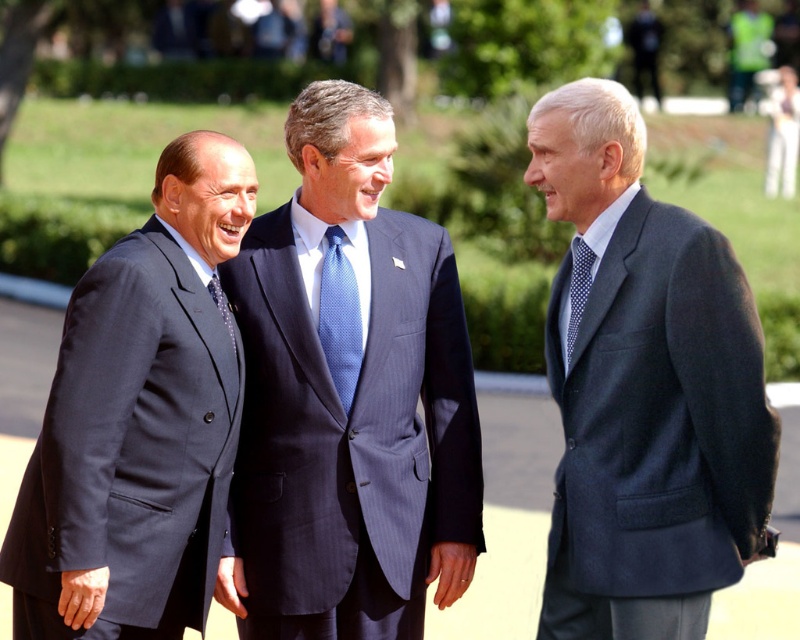
Question: Can you confirm if blue pinstripe suit at center is positioned above matte black tie at center?

Choices:
 (A) yes
 (B) no

Answer: (B)

Question: Estimate the real-world distances between objects in this image. Which object is farther from the blue pinstripe suit at center?

Choices:
 (A) blue dotted tie at center
 (B) dark blue suit at left
 (C) polka dot silk tie at center
 (D) dark gray wool suit at right

Answer: (C)

Question: Which object is the closest to the dark blue suit at left?

Choices:
 (A) matte black tie at center
 (B) blue dotted tie at center
 (C) dark gray wool suit at right

Answer: (A)

Question: Which of the following is the closest to the observer?

Choices:
 (A) (322, 344)
 (B) (588, 291)
 (C) (366, 419)

Answer: (B)

Question: Is dark blue suit at left positioned in front of polka dot silk tie at center?

Choices:
 (A) no
 (B) yes

Answer: (B)

Question: Observing the image, what is the correct spatial positioning of blue pinstripe suit at center in reference to dark blue suit at left?

Choices:
 (A) below
 (B) above

Answer: (B)